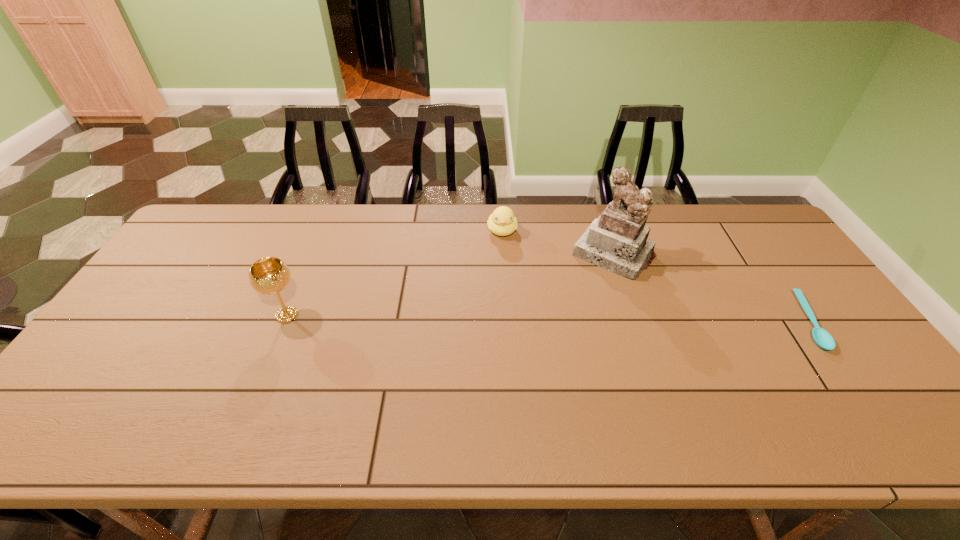
Where is `free spot on the desktop that is between the chalice and the shortest object and is positioned on the front-facing side of the figurine`? free spot on the desktop that is between the chalice and the shortest object and is positioned on the front-facing side of the figurine is located at coordinates (564, 319).

What are the coordinates of `vacant space on the desktop that is between the chalice and the rightmost object and is positioned at the beak of the third object from right to left` in the screenshot? It's located at (513, 318).